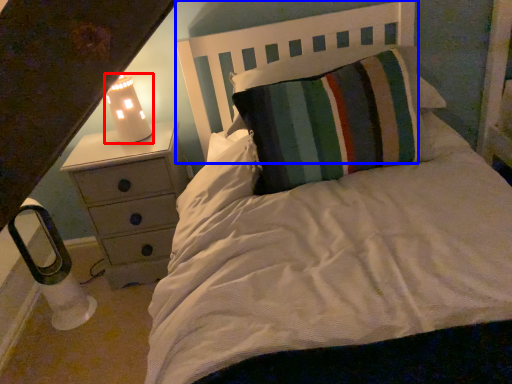
Question: Among these objects, which one is nearest to the camera, lamp (highlighted by a red box) or headboard (highlighted by a blue box)?

Choices:
 (A) lamp
 (B) headboard

Answer: (B)